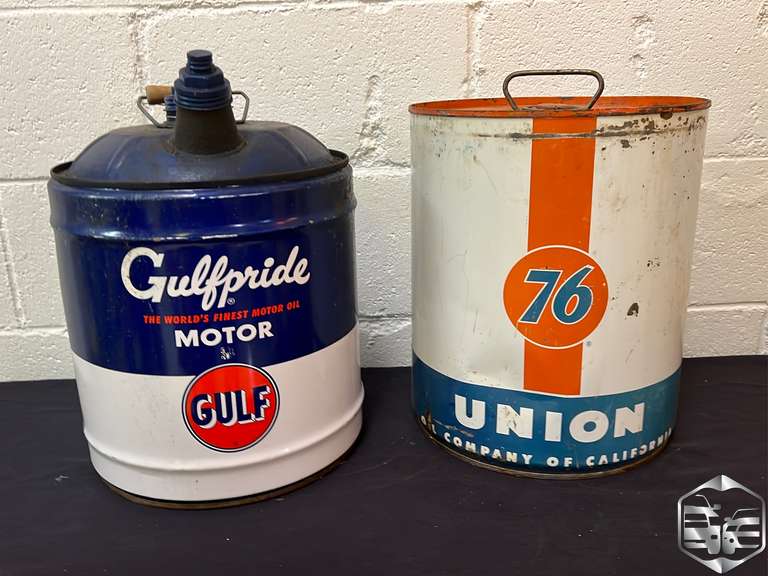
Locate an element on the screen. bricks in wall is located at coordinates (51, 82), (296, 51), (550, 44), (2, 310), (37, 287), (382, 231), (733, 244), (37, 371), (392, 351), (727, 332).